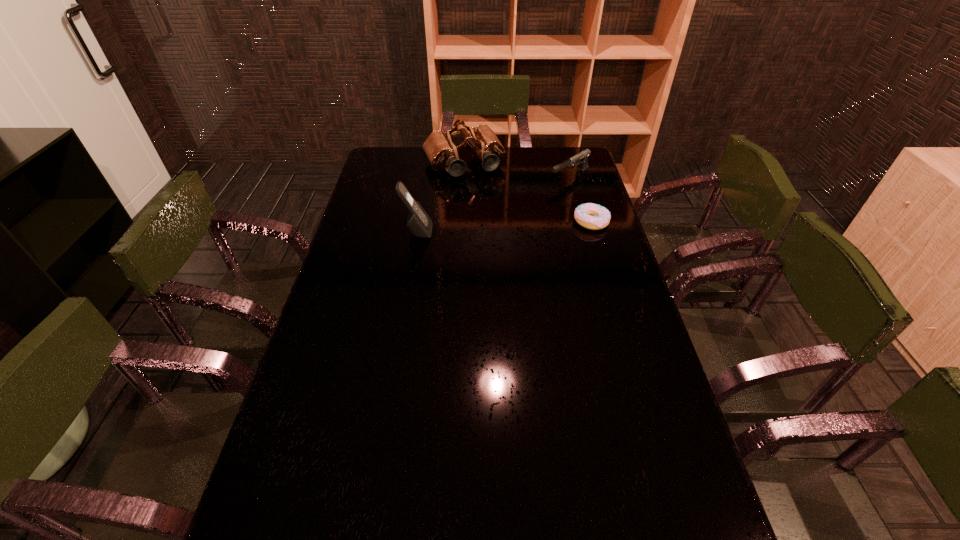
Find the location of a particular element. The image size is (960, 540). free space on the desktop that is between the tallest object and the doughnut and is positioned through the eyepieces of the binoculars is located at coordinates (498, 227).

The image size is (960, 540). Find the location of `vacant spot on the desktop that is between the tallest object and the doughnut and is positioned at the muzzle end of the third tallest object`. vacant spot on the desktop that is between the tallest object and the doughnut and is positioned at the muzzle end of the third tallest object is located at coordinates (480, 228).